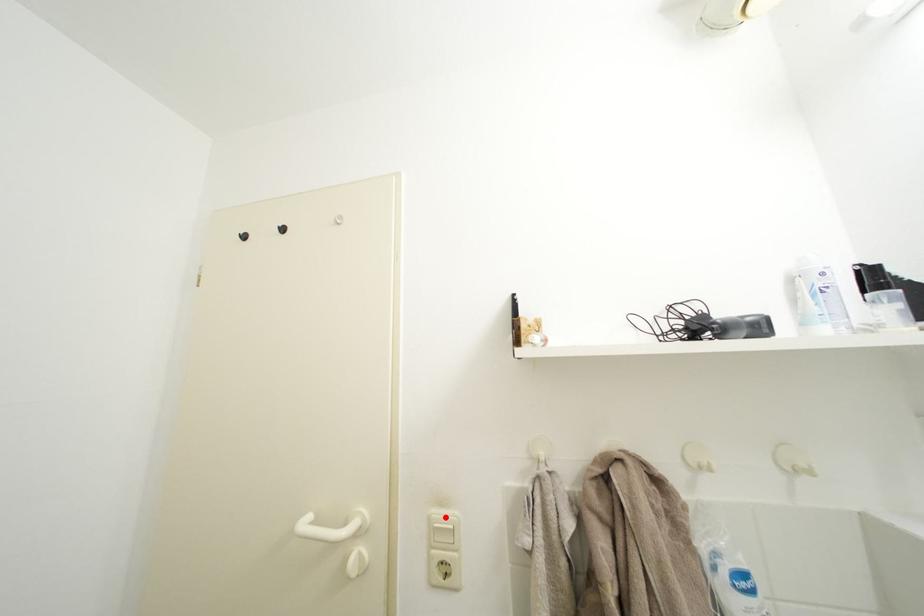
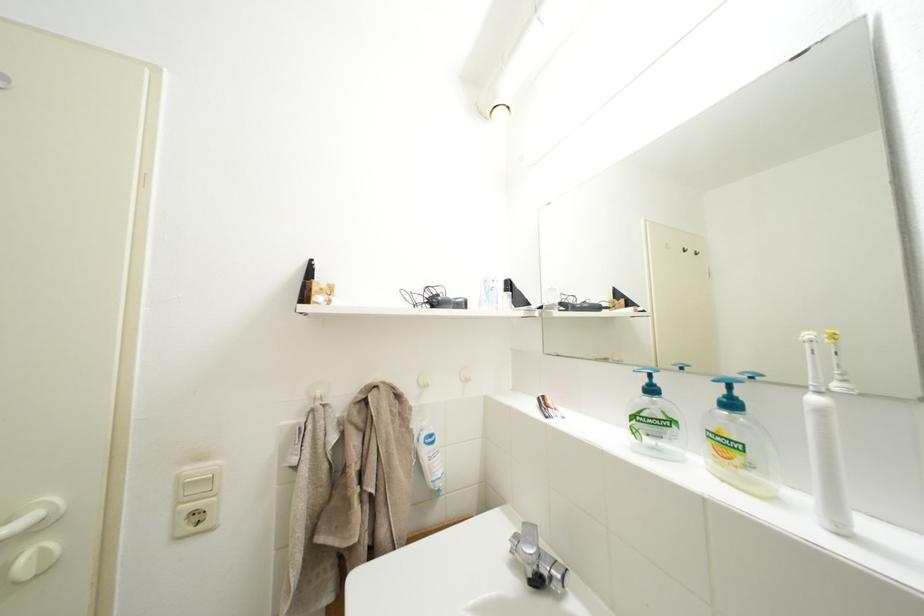
Where in the second image is the point corresponding to the highlighted location from the first image?

(200, 475)